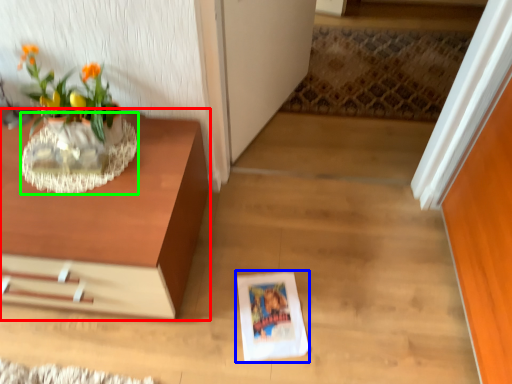
Question: Estimate the real-world distances between objects in this image. Which object is farther from table (highlighted by a red box), paperback book (highlighted by a blue box) or vase (highlighted by a green box)?

Choices:
 (A) paperback book
 (B) vase

Answer: (A)